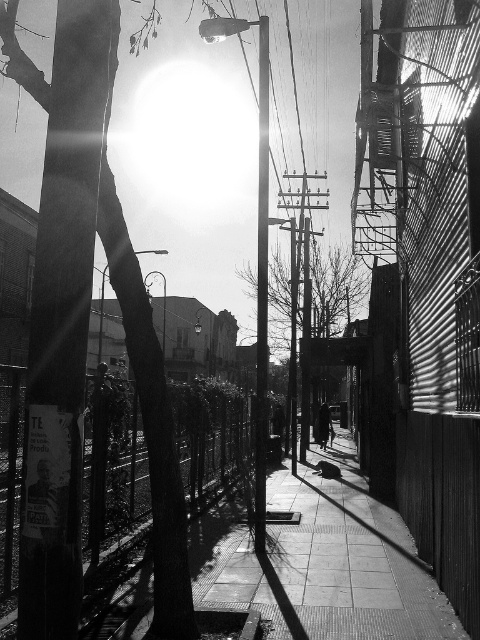
Can you confirm if smooth concrete pavement at center is bigger than dark fabric coat at center?

Yes, smooth concrete pavement at center is bigger than dark fabric coat at center.

Between smooth concrete pavement at center and dark fabric coat at center, which one appears on the left side from the viewer's perspective?

Positioned to the left is smooth concrete pavement at center.

The height and width of the screenshot is (640, 480). Identify the location of smooth concrete pavement at center. 382,545.

Locate an element on the screen. This screenshot has height=640, width=480. smooth concrete pavement at center is located at coordinates 382,545.

Does smooth concrete pavement at center have a lesser height compared to smooth metal pole at center?

Yes.

Does smooth concrete pavement at center appear over smooth metal pole at center?

Actually, smooth concrete pavement at center is below smooth metal pole at center.

Where is `smooth concrete pavement at center`? This screenshot has height=640, width=480. smooth concrete pavement at center is located at coordinates (382, 545).

At what (x,y) coordinates should I click in order to perform the action: click on smooth concrete pavement at center. Please return your answer as a coordinate pair (x, y). The width and height of the screenshot is (480, 640). Looking at the image, I should click on (382, 545).

Between smooth metal pole at center and dark fabric coat at center, which one is positioned higher?

smooth metal pole at center is higher up.

Measure the distance between point (260, 33) and camera.

Point (260, 33) and camera are 32.81 feet apart.

Where is `smooth metal pole at center`? Image resolution: width=480 pixels, height=640 pixels. smooth metal pole at center is located at coordinates (262, 291).